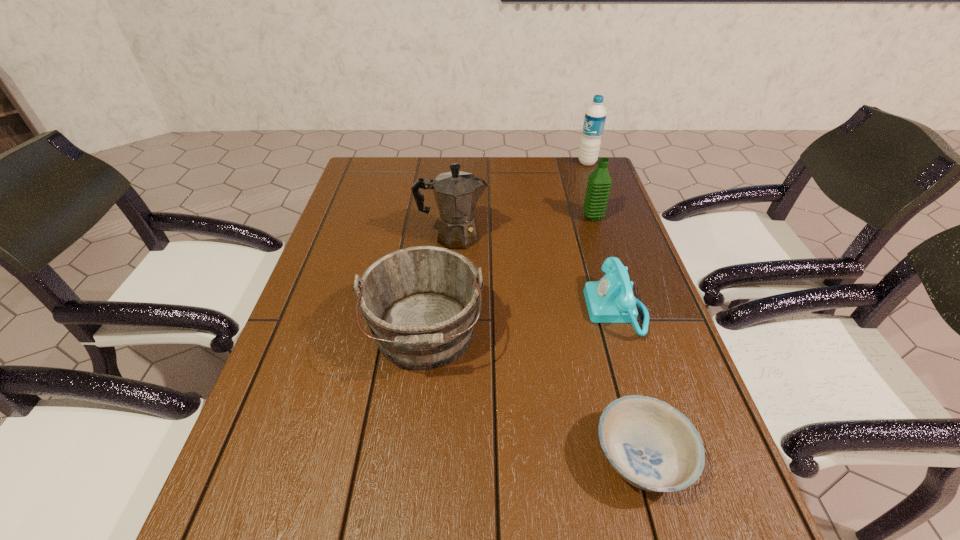
In order to click on free space that is in between the nearest object and the fourth tallest object in this screenshot , I will do `click(533, 396)`.

Locate an element on the screen. free spot between the wine bucket and the farther water bottle is located at coordinates (506, 248).

Find the location of `vacant point located between the fourth nearest object and the telephone`. vacant point located between the fourth nearest object and the telephone is located at coordinates click(x=535, y=273).

At what (x,y) coordinates should I click in order to perform the action: click on empty location between the wine bucket and the shorter water bottle. Please return your answer as a coordinate pair (x, y). Image resolution: width=960 pixels, height=540 pixels. Looking at the image, I should click on (509, 275).

Image resolution: width=960 pixels, height=540 pixels. I want to click on empty space between the second farthest object and the bowl, so click(617, 338).

You are a GUI agent. You are given a task and a screenshot of the screen. Output one action in this format:
    pyautogui.click(x=<x>, y=<y>)
    Task: Click on the object that stands as the fourth closest to the fifth nearest object
    
    Given the screenshot: What is the action you would take?
    pyautogui.click(x=420, y=303)

Choose which object is the fourth nearest neighbor to the coffeepot. Please provide its 2D coordinates. Your answer should be formatted as a tuple, i.e. [(x, y)], where the tuple contains the x and y coordinates of a point satisfying the conditions above.

[(595, 115)]

Identify the location of vacant space that satisfies the following two spatial constraints: 1. on the front side of the nearer water bottle; 2. on the dial of the telephone. This screenshot has height=540, width=960. (622, 310).

Image resolution: width=960 pixels, height=540 pixels. Identify the location of free spot that satisfies the following two spatial constraints: 1. on the front side of the bowl; 2. on the right side of the third shortest object. (411, 458).

Where is `free space that satisfies the following two spatial constraints: 1. on the pouring side of the fourth nearest object; 2. on the left side of the shortest object`? The height and width of the screenshot is (540, 960). free space that satisfies the following two spatial constraints: 1. on the pouring side of the fourth nearest object; 2. on the left side of the shortest object is located at coordinates (437, 458).